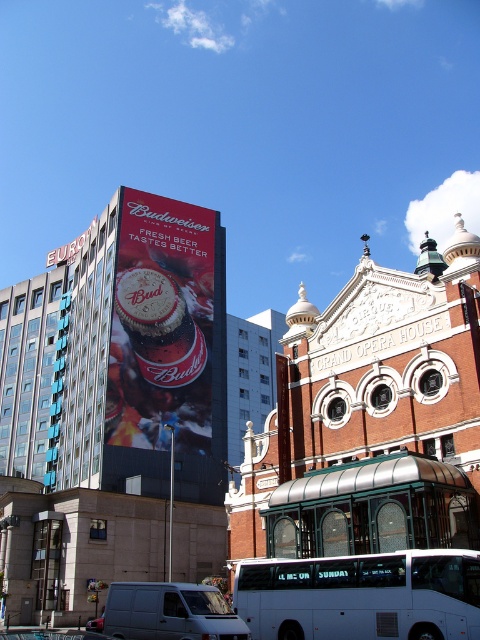
Does point (337, 620) come closer to viewer compared to point (131, 636)?

That is True.

Does white matte bus at lower center have a greater width compared to white matte van at center?

Correct, the width of white matte bus at lower center exceeds that of white matte van at center.

Who is more distant from viewer, [400,589] or [144,604]?

The point [144,604] is more distant.

The image size is (480, 640). What are the coordinates of `white matte bus at lower center` in the screenshot? It's located at (362, 596).

Does point (120, 204) lie in front of point (298, 612)?

No, (120, 204) is behind (298, 612).

Which is above, matte red beer can at upper center or white matte bus at lower center?

matte red beer can at upper center is higher up.

Between point (200, 292) and point (313, 598), which one is positioned in front?

Point (313, 598) is in front.

Where is `matte red beer can at upper center`? The width and height of the screenshot is (480, 640). matte red beer can at upper center is located at coordinates (162, 324).

Describe the element at coordinates (162, 324) in the screenshot. I see `matte red beer can at upper center` at that location.

Between matte red beer can at upper center and white matte van at center, which one is positioned higher?

matte red beer can at upper center

Describe the element at coordinates (162, 324) in the screenshot. I see `matte red beer can at upper center` at that location.

The height and width of the screenshot is (640, 480). Find the location of `matte red beer can at upper center`. matte red beer can at upper center is located at coordinates (162, 324).